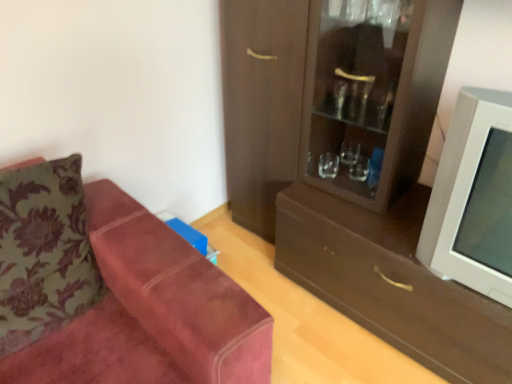
Question: From the image's perspective, is velvet floral pillow at left located above brown matte drawer at center?

Choices:
 (A) no
 (B) yes

Answer: (B)

Question: Considering the relative sizes of velvet floral pillow at left and brown matte drawer at center in the image provided, is velvet floral pillow at left wider than brown matte drawer at center?

Choices:
 (A) yes
 (B) no

Answer: (B)

Question: Could brown matte drawer at center be considered to be inside velvet floral pillow at left?

Choices:
 (A) no
 (B) yes

Answer: (A)

Question: Can you confirm if velvet floral pillow at left is smaller than brown matte drawer at center?

Choices:
 (A) no
 (B) yes

Answer: (B)

Question: Is velvet floral pillow at left to the left of brown matte drawer at center from the viewer's perspective?

Choices:
 (A) yes
 (B) no

Answer: (A)

Question: Looking at the image, does suede couch at left seem bigger or smaller compared to matte brown cabinet at right?

Choices:
 (A) small
 (B) big

Answer: (B)

Question: From the image's perspective, is suede couch at left positioned above or below matte brown cabinet at right?

Choices:
 (A) below
 (B) above

Answer: (A)

Question: Which is correct: suede couch at left is inside matte brown cabinet at right, or outside of it?

Choices:
 (A) inside
 (B) outside

Answer: (B)

Question: Relative to matte brown cabinet at right, is suede couch at left in front or behind?

Choices:
 (A) front
 (B) behind

Answer: (A)

Question: In terms of height, does matte brown cabinet at right look taller or shorter compared to white plastic television at right?

Choices:
 (A) short
 (B) tall

Answer: (B)

Question: Considering the relative positions of matte brown cabinet at right and white plastic television at right in the image provided, is matte brown cabinet at right to the left or to the right of white plastic television at right?

Choices:
 (A) left
 (B) right

Answer: (A)

Question: From the image's perspective, is matte brown cabinet at right positioned above or below white plastic television at right?

Choices:
 (A) below
 (B) above

Answer: (B)

Question: Does point (325, 29) appear closer or farther from the camera than point (440, 236)?

Choices:
 (A) closer
 (B) farther

Answer: (B)

Question: Is suede couch at left to the left or to the right of velvet floral pillow at left in the image?

Choices:
 (A) left
 (B) right

Answer: (B)

Question: In terms of height, does suede couch at left look taller or shorter compared to velvet floral pillow at left?

Choices:
 (A) tall
 (B) short

Answer: (A)